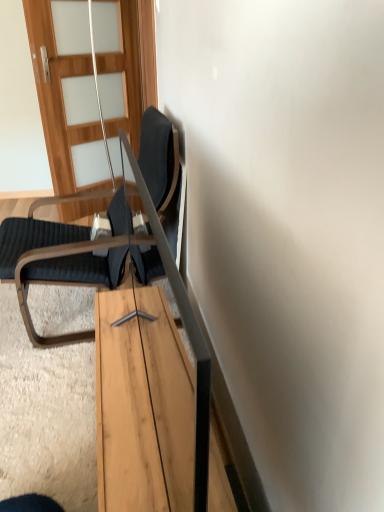
Question: Considering the relative positions of light wood table at center and wooden with frosted glass at upper left in the image provided, is light wood table at center to the left of wooden with frosted glass at upper left from the viewer's perspective?

Choices:
 (A) yes
 (B) no

Answer: (B)

Question: Is light wood table at center oriented away from wooden with frosted glass at upper left?

Choices:
 (A) no
 (B) yes

Answer: (A)

Question: From the image's perspective, would you say light wood table at center is positioned over wooden with frosted glass at upper left?

Choices:
 (A) no
 (B) yes

Answer: (A)

Question: Does light wood table at center appear on the right side of wooden with frosted glass at upper left?

Choices:
 (A) yes
 (B) no

Answer: (A)

Question: Is light wood table at center wider than wooden with frosted glass at upper left?

Choices:
 (A) yes
 (B) no

Answer: (B)

Question: Can you confirm if light wood table at center is thinner than wooden with frosted glass at upper left?

Choices:
 (A) yes
 (B) no

Answer: (A)

Question: Is dark gray fabric chair at left directly adjacent to light wood table at center?

Choices:
 (A) yes
 (B) no

Answer: (B)

Question: Is dark gray fabric chair at left facing away from light wood table at center?

Choices:
 (A) no
 (B) yes

Answer: (A)

Question: Is dark gray fabric chair at left bigger than light wood table at center?

Choices:
 (A) no
 (B) yes

Answer: (B)

Question: Can you confirm if dark gray fabric chair at left is wider than light wood table at center?

Choices:
 (A) no
 (B) yes

Answer: (B)

Question: From the image's perspective, would you say dark gray fabric chair at left is positioned over light wood table at center?

Choices:
 (A) yes
 (B) no

Answer: (A)

Question: Can you confirm if dark gray fabric chair at left is taller than light wood table at center?

Choices:
 (A) yes
 (B) no

Answer: (A)

Question: Can you confirm if wooden with frosted glass at upper left is taller than light wood table at center?

Choices:
 (A) yes
 (B) no

Answer: (A)